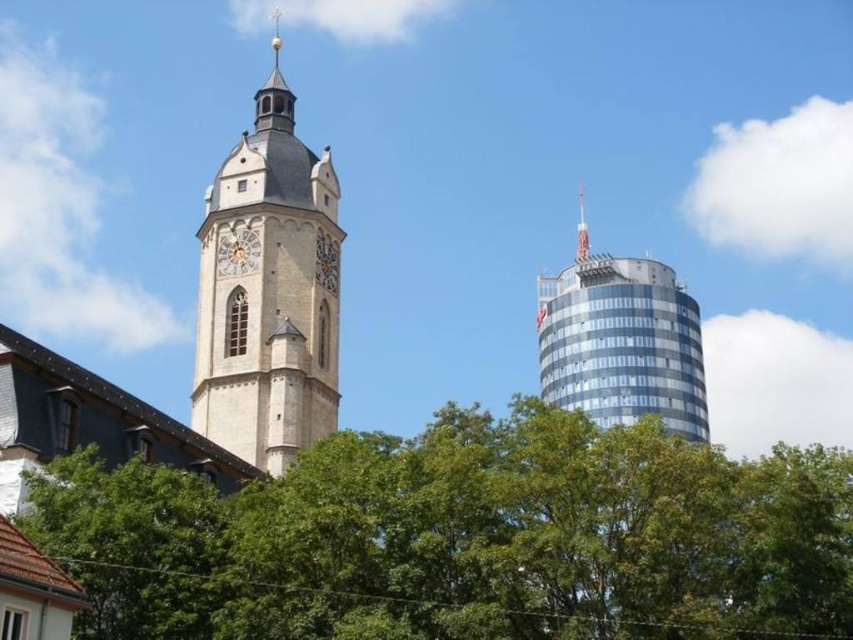
Question: Which object appears farthest from the camera in this image?

Choices:
 (A) green leafy tree at center
 (B) golden textured clock at center

Answer: (B)

Question: Does green leafy tree at center appear over blue glass skyscraper at right?

Choices:
 (A) yes
 (B) no

Answer: (B)

Question: Which object appears farthest from the camera in this image?

Choices:
 (A) golden textured clock at center
 (B) green leafy tree at center
 (C) polished silver spire at upper right
 (D) matte stone clock at center-left

Answer: (C)

Question: Does beige stone tower at left appear under polished silver spire at upper right?

Choices:
 (A) yes
 (B) no

Answer: (B)

Question: Where is blue glass skyscraper at right located in relation to matte stone clock at center-left in the image?

Choices:
 (A) above
 (B) below

Answer: (B)

Question: Which point is closer to the camera taking this photo?

Choices:
 (A) coord(515,419)
 (B) coord(558,371)
 (C) coord(221,244)

Answer: (A)